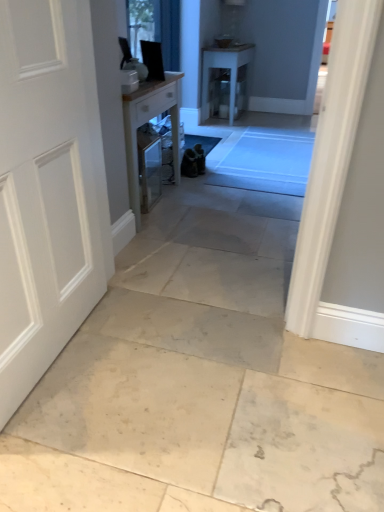
At what (x,y) coordinates should I click in order to perform the action: click on wooden table at center, the first table positioned from the bottom. Please return your answer as a coordinate pair (x, y). The width and height of the screenshot is (384, 512). Looking at the image, I should click on (146, 122).

From the image's perspective, which one is positioned higher, wooden table at center, positioned as the 2th table in back-to-front order, or clear glass window at upper center?

From the image's view, clear glass window at upper center is above.

Is wooden table at center, the first table positioned from the bottom, in front of or behind clear glass window at upper center in the image?

Clearly, wooden table at center, the first table positioned from the bottom, is in front of clear glass window at upper center.

Visually, is wooden table at center, which is the second table in top-to-bottom order, positioned to the left or to the right of clear glass window at upper center?

In the image, wooden table at center, which is the second table in top-to-bottom order, appears on the right side of clear glass window at upper center.

Is there a large distance between wooden table at center, which appears as the 1th table when viewed from the left, and clear glass window at upper center?

wooden table at center, which appears as the 1th table when viewed from the left, is near clear glass window at upper center, not far away.

Can clear glass window at upper center be found inside white glossy table at center, positioned as the 2th table in front-to-back order?

Actually, clear glass window at upper center is outside white glossy table at center, positioned as the 2th table in front-to-back order.

Which point is more forward, [244,60] or [146,16]?

The point [146,16] is in front.

Looking at the image, does white glossy table at center, which ranks as the 2th table in left-to-right order, seem bigger or smaller compared to clear glass window at upper center?

Clearly, white glossy table at center, which ranks as the 2th table in left-to-right order, is larger in size than clear glass window at upper center.

Between white glossy table at center, placed as the 1th table when sorted from top to bottom, and clear glass window at upper center, which one has smaller width?

Thinner between the two is clear glass window at upper center.

From a real-world perspective, is white matte door at left beneath white glossy table at center, positioned as the 2th table in front-to-back order?

No.

In the image, there is a white glossy table at center, which ranks as the 2th table in left-to-right order. Where is `door below it (from the image's perspective)`? This screenshot has height=512, width=384. door below it (from the image's perspective) is located at coordinates (48, 188).

Which object is further away from the camera taking this photo, white matte door at left or white glossy table at center, which ranks as the 2th table in left-to-right order?

white glossy table at center, which ranks as the 2th table in left-to-right order.

Which of these two, white matte door at left or white glossy table at center, which ranks as the 2th table in left-to-right order, stands shorter?

With less height is white glossy table at center, which ranks as the 2th table in left-to-right order.

Considering the relative positions of clear glass window at upper center and white matte door at left in the image provided, is clear glass window at upper center to the left of white matte door at left from the viewer's perspective?

In fact, clear glass window at upper center is to the right of white matte door at left.

Are clear glass window at upper center and white matte door at left making contact?

clear glass window at upper center is not next to white matte door at left, and they're not touching.

Between clear glass window at upper center and white matte door at left, which one has larger size?

white matte door at left.

Can you confirm if clear glass window at upper center is shorter than white matte door at left?

Yes.

From the picture: Which object is positioned more to the left, clear glass window at upper center or white glossy table at center, the 1th table positioned from the back?

Positioned to the left is clear glass window at upper center.

Is clear glass window at upper center oriented away from white glossy table at center, which is the 2th table from bottom to top?

That's not correct — clear glass window at upper center is not looking away from white glossy table at center, which is the 2th table from bottom to top.

Is clear glass window at upper center in front of white glossy table at center, which is counted as the 1th table, starting from the right?

Yes, the depth of clear glass window at upper center is less than that of white glossy table at center, which is counted as the 1th table, starting from the right.

Is clear glass window at upper center inside the boundaries of white glossy table at center, which is counted as the 1th table, starting from the right, or outside?

The correct answer is: outside.

From the picture: Measure the distance from white glossy table at center, which ranks as the 2th table in left-to-right order, to wooden table at center, positioned as the 2th table in back-to-front order.

2.10 meters.

Considering the relative positions of white glossy table at center, which ranks as the 2th table in left-to-right order, and wooden table at center, which is the second table in top-to-bottom order, in the image provided, is white glossy table at center, which ranks as the 2th table in left-to-right order, to the left of wooden table at center, which is the second table in top-to-bottom order, from the viewer's perspective?

In fact, white glossy table at center, which ranks as the 2th table in left-to-right order, is to the right of wooden table at center, which is the second table in top-to-bottom order.

From the image's perspective, relative to wooden table at center, the second table in the right-to-left sequence, is white glossy table at center, positioned as the 2th table in front-to-back order, above or below?

Based on their image positions, white glossy table at center, positioned as the 2th table in front-to-back order, is located above wooden table at center, the second table in the right-to-left sequence.

Is point (236, 66) positioned in front of point (40, 205)?

No, (236, 66) is behind (40, 205).

From a real-world perspective, is white glossy table at center, placed as the 1th table when sorted from top to bottom, physically above white matte door at left?

No.

How far apart are white glossy table at center, the 1th table positioned from the back, and white matte door at left?

The distance of white glossy table at center, the 1th table positioned from the back, from white matte door at left is 3.53 meters.

Is white glossy table at center, which is counted as the 1th table, starting from the right, directly adjacent to white matte door at left?

No, white glossy table at center, which is counted as the 1th table, starting from the right, is not beside white matte door at left.

I want to click on window screen located on the left of wooden table at center, the first table positioned from the bottom, so click(x=142, y=23).

The width and height of the screenshot is (384, 512). There is a clear glass window at upper center. In order to click on the 2nd table below it (from a real-world perspective) in this screenshot , I will do `click(224, 68)`.

When comparing their distances from white glossy table at center, positioned as the 2th table in front-to-back order, does clear glass window at upper center or wooden table at center, positioned as the 2th table in back-to-front order, seem closer?

Among the two, wooden table at center, positioned as the 2th table in back-to-front order, is located nearer to white glossy table at center, positioned as the 2th table in front-to-back order.

Based on the photo, based on their spatial positions, is clear glass window at upper center or white glossy table at center, placed as the 1th table when sorted from top to bottom, further from white matte door at left?

The object further to white matte door at left is white glossy table at center, placed as the 1th table when sorted from top to bottom.

Looking at the image, which one is located further to white glossy table at center, the 1th table positioned from the back, clear glass window at upper center or white matte door at left?

white matte door at left is further to white glossy table at center, the 1th table positioned from the back.

Estimate the real-world distances between objects in this image. Which object is further from white glossy table at center, positioned as the 2th table in front-to-back order, white matte door at left or clear glass window at upper center?

white matte door at left lies further to white glossy table at center, positioned as the 2th table in front-to-back order, than the other object.

From the image, which object appears to be nearer to clear glass window at upper center, wooden table at center, positioned as the 2th table in back-to-front order, or white glossy table at center, the 1th table positioned from the back?

Based on the image, wooden table at center, positioned as the 2th table in back-to-front order, appears to be nearer to clear glass window at upper center.

Consider the image. Which object lies further to the anchor point clear glass window at upper center, white matte door at left or white glossy table at center, positioned as the 2th table in front-to-back order?

Among the two, white glossy table at center, positioned as the 2th table in front-to-back order, is located further to clear glass window at upper center.

Estimate the real-world distances between objects in this image. Which object is further from white matte door at left, wooden table at center, which is counted as the first table, starting from the front, or white glossy table at center, positioned as the 2th table in front-to-back order?

white glossy table at center, positioned as the 2th table in front-to-back order, is further to white matte door at left.

Looking at the image, which one is located closer to white matte door at left, white glossy table at center, which ranks as the 2th table in left-to-right order, or clear glass window at upper center?

Among the two, clear glass window at upper center is located nearer to white matte door at left.

At what (x,y) coordinates should I click in order to perform the action: click on table between white matte door at left and clear glass window at upper center from front to back. Please return your answer as a coordinate pair (x, y). Looking at the image, I should click on (146, 122).

Where is `window screen between white matte door at left and white glossy table at center, which ranks as the 2th table in left-to-right order, in the front-back direction`? This screenshot has height=512, width=384. window screen between white matte door at left and white glossy table at center, which ranks as the 2th table in left-to-right order, in the front-back direction is located at coordinates (142, 23).

At what (x,y) coordinates should I click in order to perform the action: click on table between white matte door at left and white glossy table at center, which ranks as the 2th table in left-to-right order, along the z-axis. Please return your answer as a coordinate pair (x, y). Looking at the image, I should click on pyautogui.click(x=146, y=122).

The height and width of the screenshot is (512, 384). I want to click on window screen located between wooden table at center, which appears as the 1th table when viewed from the left, and white glossy table at center, placed as the 1th table when sorted from top to bottom, in the depth direction, so click(142, 23).